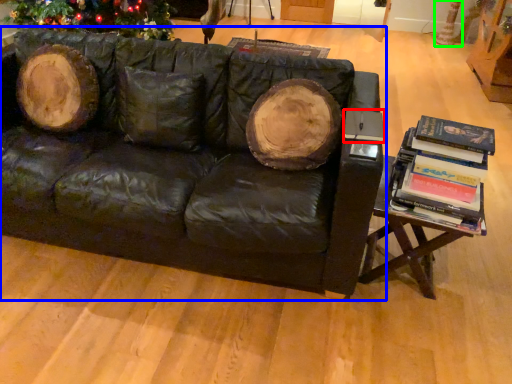
Question: Which object is positioned closest to paperback book (highlighted by a red box)? Select from studio couch (highlighted by a blue box) and tree trunk (highlighted by a green box).

Choices:
 (A) studio couch
 (B) tree trunk

Answer: (A)